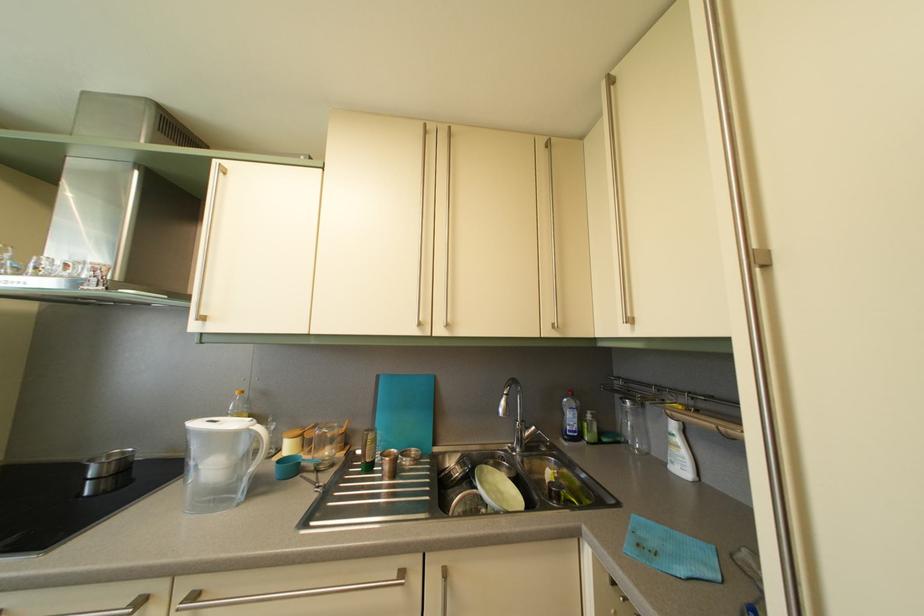
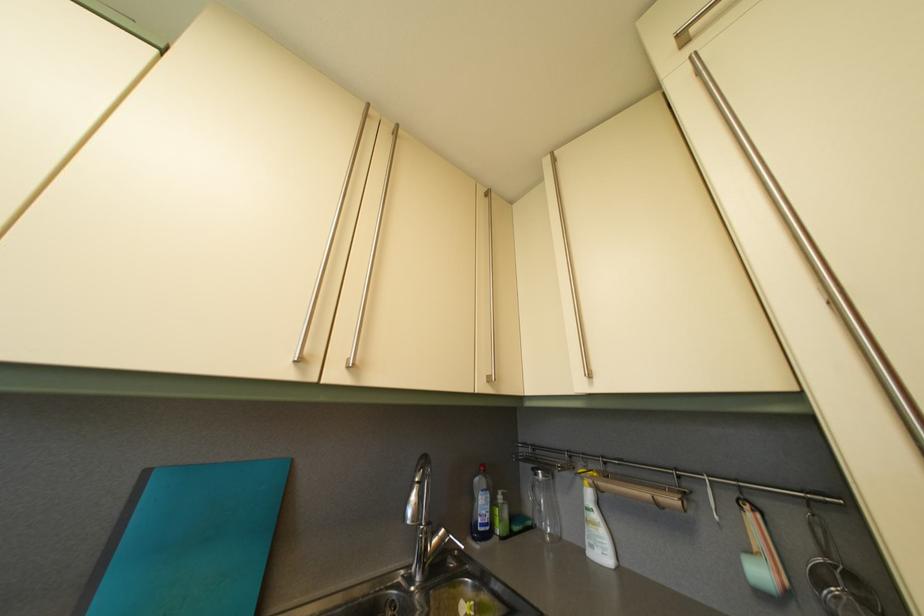
Find the pixel in the second image that matches [633,408] in the first image.

(544, 482)